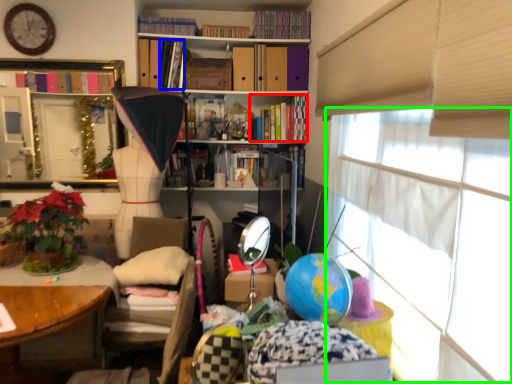
Question: Based on their relative distances, which object is nearer to book (highlighted by a red box)? Choose from book (highlighted by a blue box) and window screen (highlighted by a green box).

Choices:
 (A) book
 (B) window screen

Answer: (A)